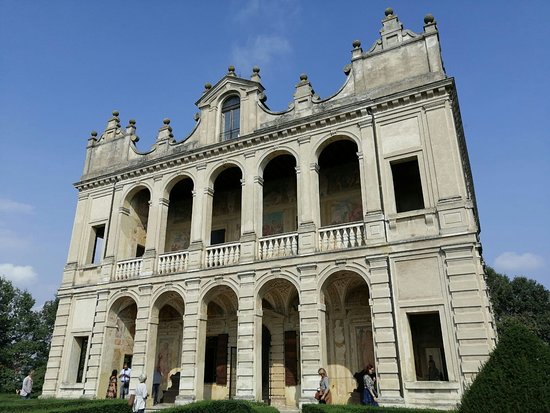
Identify the location of window ledge. Image resolution: width=550 pixels, height=413 pixels. [x=422, y=212], [x=424, y=387], [x=64, y=386], [x=87, y=268].